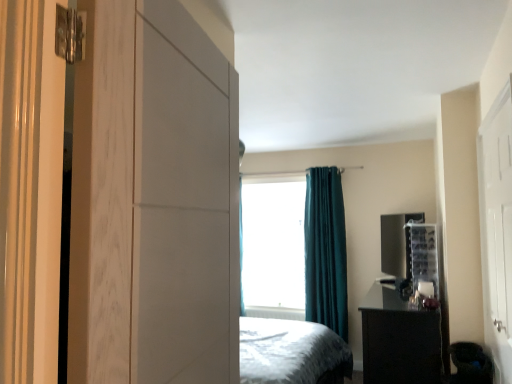
What is the approximate width of transparent plastic window screen at center?

transparent plastic window screen at center is 11.76 inches wide.

What is the approximate width of white matte cabinet at left?

4.57 inches.

Find the location of a particular element. transparent plastic window screen at center is located at coordinates (273, 246).

Is white glossy door at right placed right next to white matte cabinet at left?

No, white glossy door at right is not making contact with white matte cabinet at left.

Considering the relative sizes of white glossy door at right and white matte cabinet at left in the image provided, is white glossy door at right bigger than white matte cabinet at left?

Actually, white glossy door at right might be smaller than white matte cabinet at left.

How many degrees apart are the facing directions of white glossy door at right and white matte cabinet at left?

white glossy door at right and white matte cabinet at left are facing 172 degrees away from each other.

Which of these two, white glossy door at right or white matte cabinet at left, is thinner?

Thinner between the two is white glossy door at right.

Is white glossy door at right bigger or smaller than transparent plastic window screen at center?

white glossy door at right is smaller than transparent plastic window screen at center.

From the image's perspective, is white glossy door at right on top of transparent plastic window screen at center?

Yes, from the image's perspective, white glossy door at right is on top of transparent plastic window screen at center.

How different are the orientations of white glossy door at right and transparent plastic window screen at center in degrees?

white glossy door at right and transparent plastic window screen at center are facing 91 degrees away from each other.

Does black glossy nightstand at lower right have a greater width compared to white glossy door at right?

Correct, the width of black glossy nightstand at lower right exceeds that of white glossy door at right.

From the image's perspective, between black glossy nightstand at lower right and white glossy door at right, which one is located above?

white glossy door at right, from the image's perspective.

Is black glossy nightstand at lower right aimed at white glossy door at right?

No, black glossy nightstand at lower right is not facing towards white glossy door at right.

Is black glossy nightstand at lower right completely or partially outside of white glossy door at right?

Yes.

Considering the positions of objects white matte cabinet at left and white glossy door at right in the image provided, who is in front, white matte cabinet at left or white glossy door at right?

Positioned in front is white matte cabinet at left.

Which object is positioned more to the left, white matte cabinet at left or white glossy door at right?

white matte cabinet at left.

Considering the relative sizes of white matte cabinet at left and white glossy door at right in the image provided, is white matte cabinet at left taller than white glossy door at right?

In fact, white matte cabinet at left may be shorter than white glossy door at right.

Does point (149, 371) appear closer or farther from the camera than point (502, 294)?

Point (149, 371) appears to be closer to the viewer than point (502, 294).

Is black glossy nightstand at lower right not near teal velvet curtain at center?

Yes, black glossy nightstand at lower right is far from teal velvet curtain at center.

Which object is thinner, black glossy nightstand at lower right or teal velvet curtain at center?

teal velvet curtain at center is thinner.

Is black glossy nightstand at lower right turned away from teal velvet curtain at center?

No, black glossy nightstand at lower right is not facing away from teal velvet curtain at center.

From the picture: Is teal velvet curtain at center aimed at black glossy nightstand at lower right?

No, teal velvet curtain at center is not aimed at black glossy nightstand at lower right.

Is teal velvet curtain at center positioned behind black glossy nightstand at lower right?

Yes, teal velvet curtain at center is further from the camera.

Looking at the image, does teal velvet curtain at center seem bigger or smaller compared to black glossy nightstand at lower right?

Considering their sizes, teal velvet curtain at center takes up less space than black glossy nightstand at lower right.

Is teal velvet curtain at center directly adjacent to black glossy nightstand at lower right?

There is a gap between teal velvet curtain at center and black glossy nightstand at lower right.

Can you confirm if black glossy nightstand at lower right is thinner than white matte cabinet at left?

In fact, black glossy nightstand at lower right might be wider than white matte cabinet at left.

Would you say black glossy nightstand at lower right is to the left or to the right of white matte cabinet at left in the picture?

Based on their positions, black glossy nightstand at lower right is located to the right of white matte cabinet at left.

Is black glossy nightstand at lower right beside white matte cabinet at left?

They are not placed beside each other.

What's the angular difference between black glossy nightstand at lower right and white matte cabinet at left's facing directions?

The angle between the facing direction of black glossy nightstand at lower right and the facing direction of white matte cabinet at left is 174 degrees.

Identify the location of dresser on the left of white glossy door at right. (150, 197).

Locate an element on the screen. The height and width of the screenshot is (384, 512). screen door below the transparent plastic window screen at center (from a real-world perspective) is located at coordinates (497, 228).

Which object lies nearer to the anchor point white glossy door at right, black glossy nightstand at lower right or teal velvet curtain at center?

The object closer to white glossy door at right is black glossy nightstand at lower right.

Considering their positions, is transparent plastic window screen at center positioned further to black glossy nightstand at lower right than white matte cabinet at left?

The object further to black glossy nightstand at lower right is white matte cabinet at left.

Which object lies further to the anchor point transparent plastic window screen at center, black glossy nightstand at lower right or teal velvet curtain at center?

black glossy nightstand at lower right is further to transparent plastic window screen at center.

Looking at the image, which one is located further to transparent plastic window screen at center, black glossy nightstand at lower right or white glossy door at right?

white glossy door at right is positioned further to the anchor transparent plastic window screen at center.

Looking at the image, which one is located closer to teal velvet curtain at center, white matte cabinet at left or white glossy door at right?

Among the two, white glossy door at right is located nearer to teal velvet curtain at center.

Looking at the image, which one is located further to black glossy nightstand at lower right, white glossy door at right or white matte cabinet at left?

Based on the image, white matte cabinet at left appears to be further to black glossy nightstand at lower right.

From the image, which object appears to be nearer to white matte cabinet at left, teal velvet curtain at center or black glossy nightstand at lower right?

Based on the image, black glossy nightstand at lower right appears to be nearer to white matte cabinet at left.

When comparing their distances from transparent plastic window screen at center, does white glossy door at right or black glossy nightstand at lower right seem further?

Based on the image, white glossy door at right appears to be further to transparent plastic window screen at center.

I want to click on nightstand positioned between white glossy door at right and transparent plastic window screen at center from near to far, so click(399, 339).

At what (x,y) coordinates should I click in order to perform the action: click on nightstand positioned between white matte cabinet at left and transparent plastic window screen at center from near to far. Please return your answer as a coordinate pair (x, y). This screenshot has width=512, height=384. Looking at the image, I should click on coord(399,339).

Image resolution: width=512 pixels, height=384 pixels. Identify the location of screen door located between white matte cabinet at left and transparent plastic window screen at center in the depth direction. (497, 228).

Locate an element on the screen. nightstand positioned between white glossy door at right and teal velvet curtain at center from near to far is located at coordinates (399, 339).